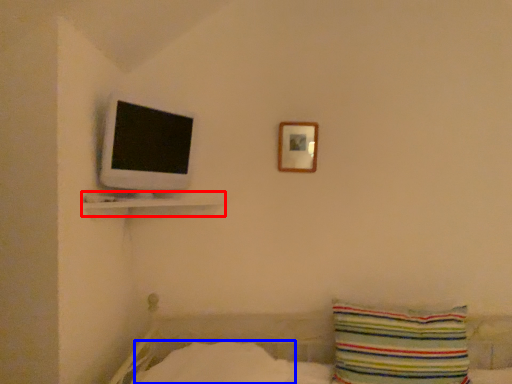
Question: Which object is closer to the camera taking this photo, shelf (highlighted by a red box) or sheet (highlighted by a blue box)?

Choices:
 (A) shelf
 (B) sheet

Answer: (B)